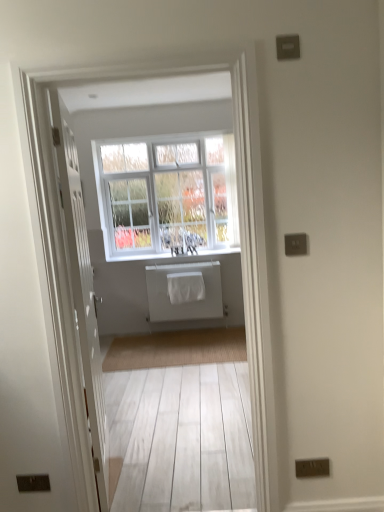
Question: Would you say white textured window at center contains white painted wood at center?

Choices:
 (A) no
 (B) yes

Answer: (B)

Question: Is white textured window at center facing away from white painted wood at center?

Choices:
 (A) yes
 (B) no

Answer: (B)

Question: Can we say white textured window at center lies outside white painted wood at center?

Choices:
 (A) yes
 (B) no

Answer: (A)

Question: Does white textured window at center turn towards white painted wood at center?

Choices:
 (A) no
 (B) yes

Answer: (A)

Question: Considering the relative positions of white textured window at center and white painted wood at center in the image provided, is white textured window at center in front of white painted wood at center?

Choices:
 (A) no
 (B) yes

Answer: (B)

Question: Is the position of white textured window at center more distant than that of white painted wood at center?

Choices:
 (A) no
 (B) yes

Answer: (A)

Question: Is white textured window at center taller than white matte radiator at center?

Choices:
 (A) no
 (B) yes

Answer: (B)

Question: From a real-world perspective, does white textured window at center stand above white matte radiator at center?

Choices:
 (A) no
 (B) yes

Answer: (B)

Question: From the image's perspective, would you say white textured window at center is shown under white matte radiator at center?

Choices:
 (A) yes
 (B) no

Answer: (B)

Question: Considering the relative positions of white textured window at center and white matte radiator at center in the image provided, is white textured window at center to the right of white matte radiator at center from the viewer's perspective?

Choices:
 (A) yes
 (B) no

Answer: (B)

Question: Can you confirm if white textured window at center is shorter than white matte radiator at center?

Choices:
 (A) no
 (B) yes

Answer: (A)

Question: Is white textured window at center surrounding white matte radiator at center?

Choices:
 (A) yes
 (B) no

Answer: (B)

Question: Is white wooden door at center smaller than white textured window at center?

Choices:
 (A) no
 (B) yes

Answer: (B)